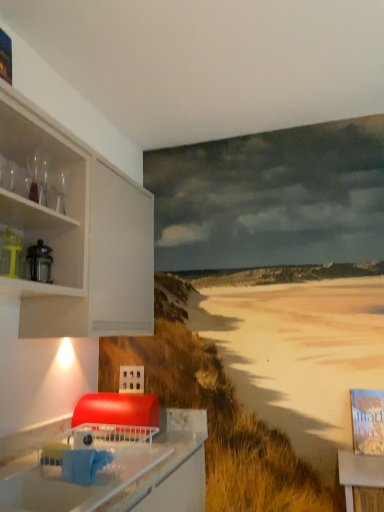
Measure the distance between white glossy countertop at lower left and camera.

The distance of white glossy countertop at lower left from camera is 1.36 meters.

Measure the distance between point (187, 460) and camera.

Point (187, 460) and camera are 1.81 meters apart from each other.

The height and width of the screenshot is (512, 384). What do you see at coordinates (123, 474) in the screenshot? I see `white glossy countertop at lower left` at bounding box center [123, 474].

The width and height of the screenshot is (384, 512). What are the coordinates of `white glossy countertop at lower left` in the screenshot? It's located at (123, 474).

Find the location of a particular element. Image resolution: width=384 pixels, height=512 pixels. matte yellow juicer at left is located at coordinates (10, 253).

The image size is (384, 512). Describe the element at coordinates (10, 253) in the screenshot. I see `matte yellow juicer at left` at that location.

Measure the distance between point (7, 242) and camera.

Point (7, 242) is 5.17 feet from camera.

At what (x,y) coordinates should I click in order to perform the action: click on white glossy countertop at lower left. Please return your answer as a coordinate pair (x, y). Looking at the image, I should click on (123, 474).

Considering the positions of objects matte yellow juicer at left and white glossy countertop at lower left in the image provided, who is more to the right, matte yellow juicer at left or white glossy countertop at lower left?

white glossy countertop at lower left is more to the right.

Which object is further away from the camera taking this photo, matte yellow juicer at left or white glossy countertop at lower left?

matte yellow juicer at left is further from the camera.

Which is less distant, (13, 271) or (72, 505)?

The point (72, 505) is more forward.

From the image's perspective, is matte yellow juicer at left on top of white glossy countertop at lower left?

Yes, from the image's perspective, matte yellow juicer at left is above white glossy countertop at lower left.

From a real-world perspective, is matte yellow juicer at left positioned under white glossy countertop at lower left based on gravity?

No, from a real-world perspective, matte yellow juicer at left is not beneath white glossy countertop at lower left.

Can you confirm if matte yellow juicer at left is thinner than white glossy countertop at lower left?

Correct, the width of matte yellow juicer at left is less than that of white glossy countertop at lower left.

Based on the photo, considering the sizes of matte yellow juicer at left and white glossy countertop at lower left in the image, is matte yellow juicer at left taller or shorter than white glossy countertop at lower left?

Clearly, matte yellow juicer at left is shorter compared to white glossy countertop at lower left.

Considering the relative sizes of matte yellow juicer at left and white glossy countertop at lower left in the image provided, is matte yellow juicer at left bigger than white glossy countertop at lower left?

Incorrect, matte yellow juicer at left is not larger than white glossy countertop at lower left.

Is matte yellow juicer at left located outside white glossy countertop at lower left?

Yes, matte yellow juicer at left is outside of white glossy countertop at lower left.

Is matte yellow juicer at left placed right next to white glossy countertop at lower left?

matte yellow juicer at left is not next to white glossy countertop at lower left, and they're not touching.

Is matte yellow juicer at left facing towards white glossy countertop at lower left?

No.

The width and height of the screenshot is (384, 512). I want to click on appliance on the left of white glossy countertop at lower left, so click(x=10, y=253).

In the image, is white glossy countertop at lower left on the left side or the right side of matte yellow juicer at left?

In the image, white glossy countertop at lower left appears on the right side of matte yellow juicer at left.

Considering the positions of objects white glossy countertop at lower left and matte yellow juicer at left in the image provided, who is behind, white glossy countertop at lower left or matte yellow juicer at left?

matte yellow juicer at left is further from the camera.

Considering the points (33, 477) and (17, 277), which point is in front, point (33, 477) or point (17, 277)?

The point (33, 477) is closer.

From the image's perspective, is white glossy countertop at lower left located above or below matte yellow juicer at left?

From the image's perspective, white glossy countertop at lower left appears below matte yellow juicer at left.

From a real-world perspective, which object stands above the other?

matte yellow juicer at left is physically above.

Looking at this image, does white glossy countertop at lower left have a lesser width compared to matte yellow juicer at left?

Incorrect, the width of white glossy countertop at lower left is not less than that of matte yellow juicer at left.

Between white glossy countertop at lower left and matte yellow juicer at left, which one has more height?

Standing taller between the two is white glossy countertop at lower left.

Is white glossy countertop at lower left smaller than matte yellow juicer at left?

No.

Could matte yellow juicer at left be considered to be inside white glossy countertop at lower left?

No, matte yellow juicer at left is not surrounded by white glossy countertop at lower left.

From the picture: Are white glossy countertop at lower left and matte yellow juicer at left located far from each other?

Actually, white glossy countertop at lower left and matte yellow juicer at left are a little close together.

Is white glossy countertop at lower left positioned with its back to matte yellow juicer at left?

That's not correct — white glossy countertop at lower left is not looking away from matte yellow juicer at left.

How different are the orientations of white glossy countertop at lower left and matte yellow juicer at left in degrees?

The angular difference between white glossy countertop at lower left and matte yellow juicer at left is 0.193 degrees.

Where is `appliance located above the white glossy countertop at lower left (from a real-world perspective)`? appliance located above the white glossy countertop at lower left (from a real-world perspective) is located at coordinates (10, 253).

The width and height of the screenshot is (384, 512). Identify the location of appliance lying above the white glossy countertop at lower left (from the image's perspective). (10, 253).

You are a GUI agent. You are given a task and a screenshot of the screen. Output one action in this format:
    pyautogui.click(x=<x>, y=<y>)
    Task: Click on the appliance behind the white glossy countertop at lower left
    The height and width of the screenshot is (512, 384).
    Given the screenshot: What is the action you would take?
    pyautogui.click(x=10, y=253)